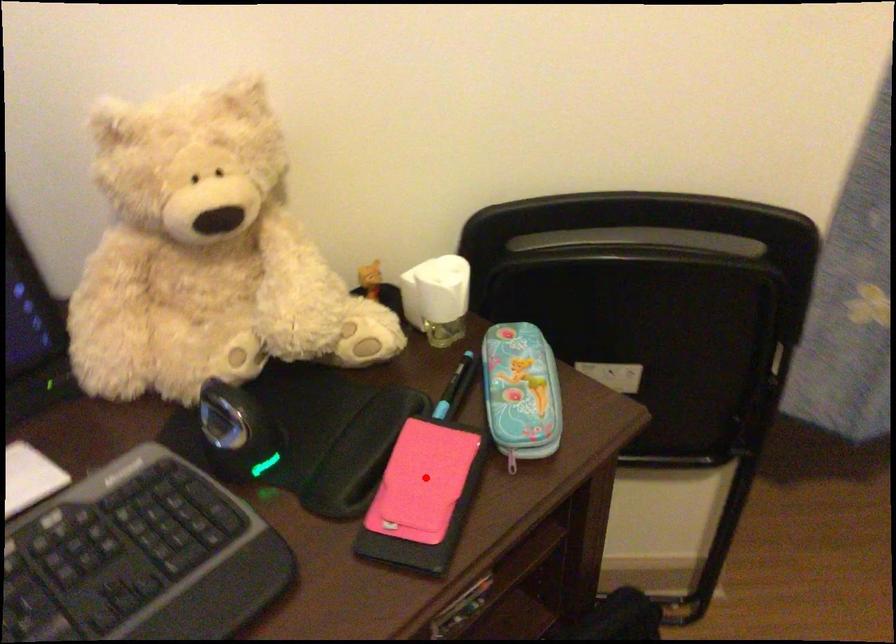
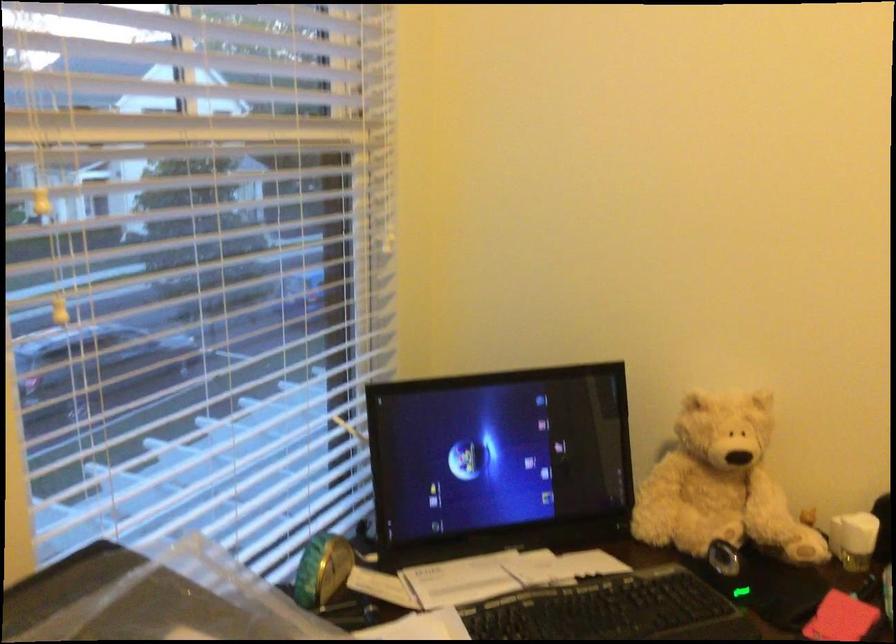
Question: I am providing you with two images of the same scene from different viewpoints. Given a red point in image1, look at the same physical point in image2. Is it:

Choices:
 (A) Closer to the viewpoint
 (B) Farther from the viewpoint

Answer: (B)